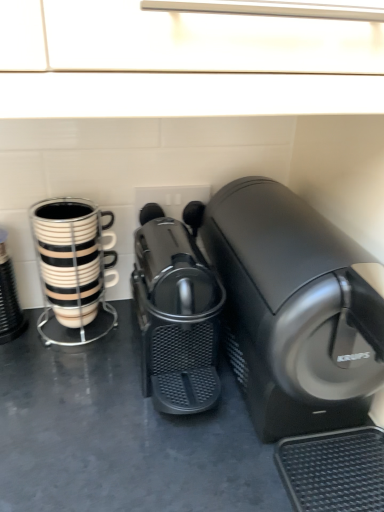
Question: Considering the relative sizes of black plastic coffee machine at center, the 1th home appliance in the left-to-right sequence, and black and white striped mug at left in the image provided, is black plastic coffee machine at center, the 1th home appliance in the left-to-right sequence, shorter than black and white striped mug at left?

Choices:
 (A) yes
 (B) no

Answer: (A)

Question: Is black plastic coffee machine at center, which ranks as the 2th home appliance in right-to-left order, not close to black and white striped mug at left?

Choices:
 (A) no
 (B) yes

Answer: (A)

Question: Is black plastic coffee machine at center, the 1th home appliance in the left-to-right sequence, behind black and white striped mug at left?

Choices:
 (A) no
 (B) yes

Answer: (A)

Question: Is black plastic coffee machine at center, which ranks as the 2th home appliance in right-to-left order, positioned beyond the bounds of black and white striped mug at left?

Choices:
 (A) yes
 (B) no

Answer: (A)

Question: Could you tell me if black plastic coffee machine at center, the 1th home appliance in the left-to-right sequence, is turned towards black and white striped mug at left?

Choices:
 (A) no
 (B) yes

Answer: (A)

Question: Is the position of black plastic coffee machine at center, which ranks as the 2th home appliance in right-to-left order, less distant than that of black and white striped mug at left?

Choices:
 (A) yes
 (B) no

Answer: (A)

Question: Can you confirm if black plastic coffee machine at center, the 2th home appliance positioned from the left, is smaller than black plastic coffee machine at center, the 1th home appliance in the left-to-right sequence?

Choices:
 (A) no
 (B) yes

Answer: (A)

Question: From the image's perspective, is black plastic coffee machine at center, marked as the first home appliance in a right-to-left arrangement, located above black plastic coffee machine at center, the 1th home appliance in the left-to-right sequence?

Choices:
 (A) no
 (B) yes

Answer: (B)

Question: Can you confirm if black plastic coffee machine at center, the 2th home appliance positioned from the left, is positioned to the left of black plastic coffee machine at center, which ranks as the 2th home appliance in right-to-left order?

Choices:
 (A) yes
 (B) no

Answer: (B)

Question: Is the surface of black plastic coffee machine at center, the 2th home appliance positioned from the left, in direct contact with black plastic coffee machine at center, which ranks as the 2th home appliance in right-to-left order?

Choices:
 (A) yes
 (B) no

Answer: (B)

Question: Would you say black plastic coffee machine at center, the 2th home appliance positioned from the left, is outside black plastic coffee machine at center, which ranks as the 2th home appliance in right-to-left order?

Choices:
 (A) no
 (B) yes

Answer: (B)

Question: Are black plastic coffee machine at center, the 2th home appliance positioned from the left, and black plastic coffee machine at center, which ranks as the 2th home appliance in right-to-left order, far apart?

Choices:
 (A) yes
 (B) no

Answer: (B)

Question: Is black glossy coffee cup at left to the right of black plastic coffee machine at center, the 2th home appliance positioned from the left, from the viewer's perspective?

Choices:
 (A) no
 (B) yes

Answer: (A)